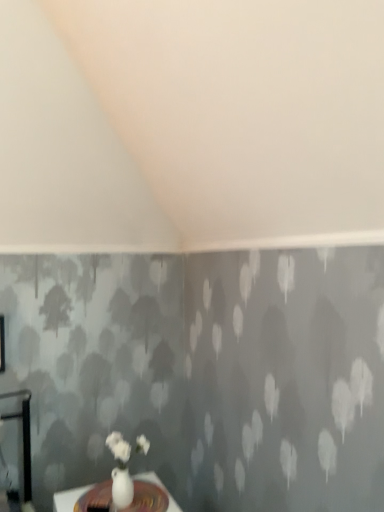
Question: Is white glossy vase at lower center taller or shorter than white glossy vase at lower center?

Choices:
 (A) tall
 (B) short

Answer: (A)

Question: Relative to white glossy vase at lower center, is white glossy vase at lower center in front or behind?

Choices:
 (A) front
 (B) behind

Answer: (B)

Question: From a real-world perspective, is white glossy vase at lower center physically located above or below white glossy vase at lower center?

Choices:
 (A) above
 (B) below

Answer: (A)

Question: Does point (168, 492) appear closer or farther from the camera than point (122, 478)?

Choices:
 (A) closer
 (B) farther

Answer: (B)

Question: Visually, is white glossy vase at lower center positioned to the left or to the right of white glossy vase at lower center?

Choices:
 (A) left
 (B) right

Answer: (A)

Question: Is white glossy vase at lower center spatially inside white glossy vase at lower center, or outside of it?

Choices:
 (A) outside
 (B) inside

Answer: (A)

Question: Is white glossy vase at lower center taller or shorter than white glossy vase at lower center?

Choices:
 (A) short
 (B) tall

Answer: (A)